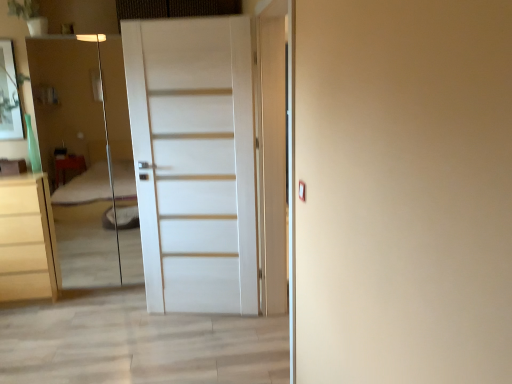
Question: Does transparent glass elevator at left appear on the right side of white matte door at center?

Choices:
 (A) no
 (B) yes

Answer: (A)

Question: Is transparent glass elevator at left positioned with its back to white matte door at center?

Choices:
 (A) yes
 (B) no

Answer: (B)

Question: Is transparent glass elevator at left bigger than white matte door at center?

Choices:
 (A) no
 (B) yes

Answer: (B)

Question: Would you consider transparent glass elevator at left to be distant from white matte door at center?

Choices:
 (A) no
 (B) yes

Answer: (B)

Question: Is transparent glass elevator at left positioned in front of white matte door at center?

Choices:
 (A) no
 (B) yes

Answer: (A)

Question: From the image's perspective, is matte white chest of drawers at left positioned above or below white matte door at center?

Choices:
 (A) above
 (B) below

Answer: (B)

Question: From their relative heights in the image, would you say matte white chest of drawers at left is taller or shorter than white matte door at center?

Choices:
 (A) tall
 (B) short

Answer: (B)

Question: Does point (1, 233) appear closer or farther from the camera than point (223, 301)?

Choices:
 (A) farther
 (B) closer

Answer: (A)

Question: Is matte white chest of drawers at left in front of or behind white matte door at center in the image?

Choices:
 (A) behind
 (B) front

Answer: (A)

Question: From a real-world perspective, is transparent glass elevator at left physically located above or below matte white chest of drawers at left?

Choices:
 (A) below
 (B) above

Answer: (B)

Question: In terms of width, does transparent glass elevator at left look wider or thinner when compared to matte white chest of drawers at left?

Choices:
 (A) thin
 (B) wide

Answer: (A)

Question: Does point (83, 122) appear closer or farther from the camera than point (49, 284)?

Choices:
 (A) closer
 (B) farther

Answer: (B)

Question: Visually, is transparent glass elevator at left positioned to the left or to the right of matte white chest of drawers at left?

Choices:
 (A) left
 (B) right

Answer: (B)

Question: In terms of width, does white matte door at center look wider or thinner when compared to matte white chest of drawers at left?

Choices:
 (A) thin
 (B) wide

Answer: (A)

Question: In the image, is white matte door at center positioned in front of or behind matte white chest of drawers at left?

Choices:
 (A) front
 (B) behind

Answer: (A)